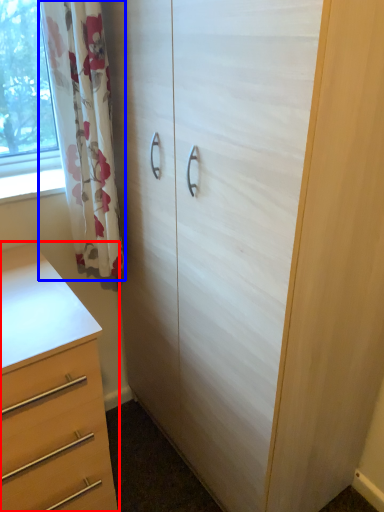
Question: Which object is further to the camera taking this photo, chest of drawers (highlighted by a red box) or curtain (highlighted by a blue box)?

Choices:
 (A) chest of drawers
 (B) curtain

Answer: (B)